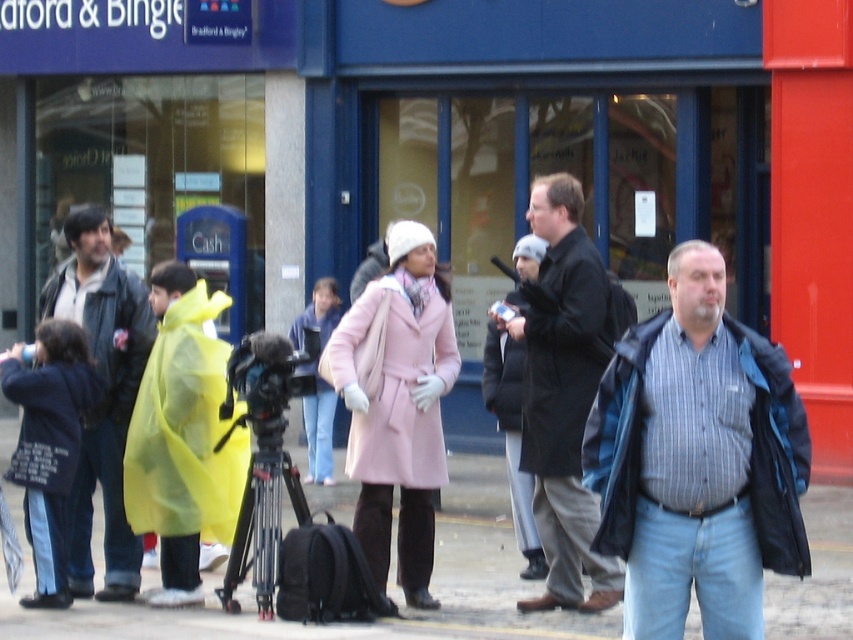
Who is more distant from viewer, (570, 244) or (56, 577)?

Point (56, 577)

Based on the photo, can you confirm if black matte coat at center is positioned to the left of dark blue jacket at left?

In fact, black matte coat at center is to the right of dark blue jacket at left.

At what (x,y) coordinates should I click in order to perform the action: click on black matte coat at center. Please return your answer as a coordinate pair (x, y). Looking at the image, I should click on (561, 353).

In order to click on black matte coat at center in this screenshot , I will do tap(561, 353).

Does matte pink coat at center have a greater width compared to black metal tripod at center?

Indeed, matte pink coat at center has a greater width compared to black metal tripod at center.

Measure the distance between point (437, 426) and camera.

Point (437, 426) and camera are 10.66 meters apart from each other.

Does point (412, 348) come in front of point (262, 509)?

No, (412, 348) is further to viewer.

At what (x,y) coordinates should I click in order to perform the action: click on matte pink coat at center. Please return your answer as a coordinate pair (x, y). Looking at the image, I should click on (393, 380).

Is yellow waterproof coat at left thinner than black metal tripod at center?

No.

Measure the distance between yellow waterproof coat at left and black metal tripod at center.

They are 15.17 inches apart.

Is point (199, 467) positioned in front of point (257, 582)?

No, it is not.

Locate an element on the screen. yellow waterproof coat at left is located at coordinates click(x=184, y=429).